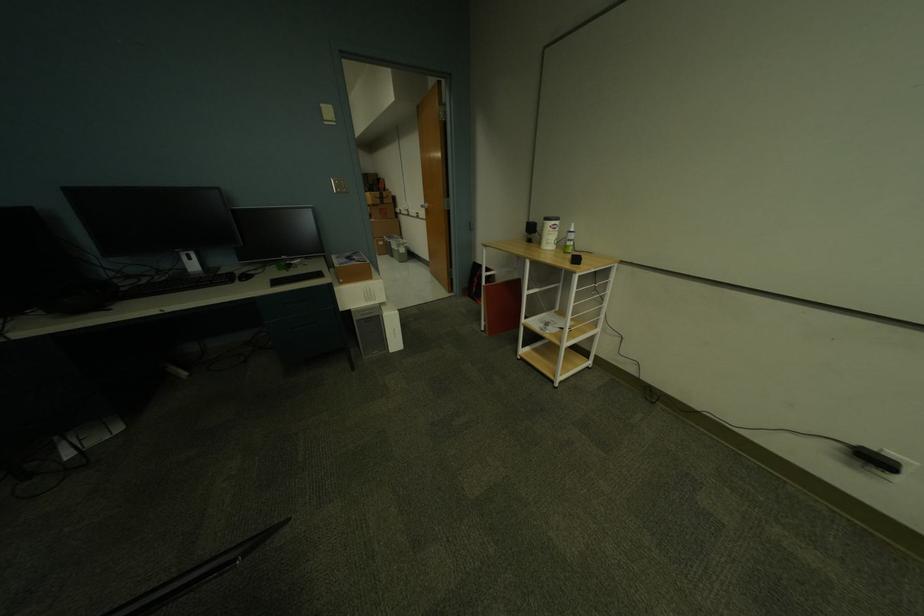
Describe the element at coordinates (432, 213) in the screenshot. I see `the silver door handle` at that location.